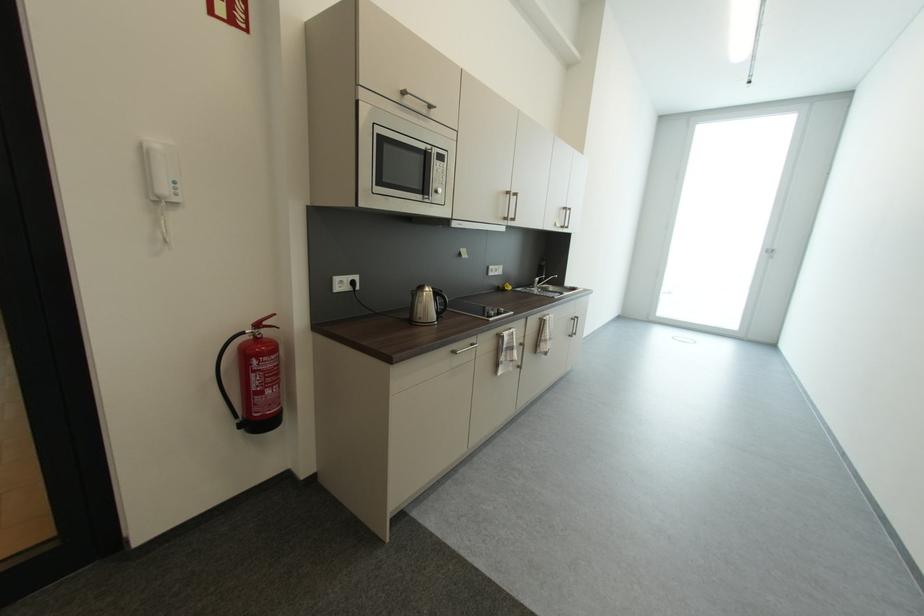
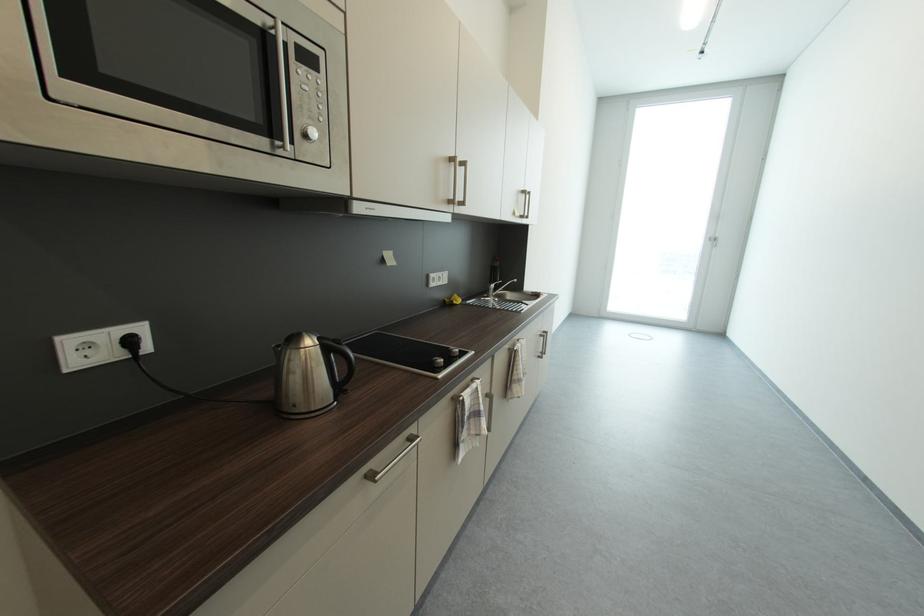
The point at (445,172) is marked in the first image. Where is the corresponding point in the second image?

(313, 89)